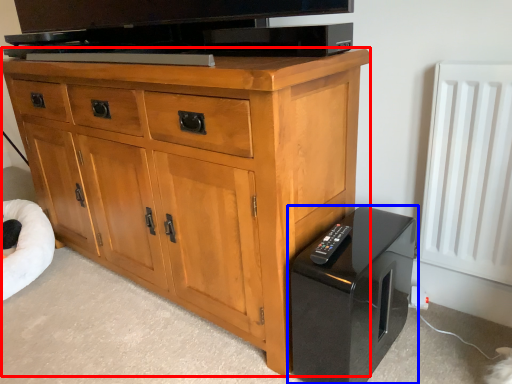
Question: Which of the following is the farthest to the observer, chest of drawers (highlighted by a red box) or home appliance (highlighted by a blue box)?

Choices:
 (A) chest of drawers
 (B) home appliance

Answer: (B)